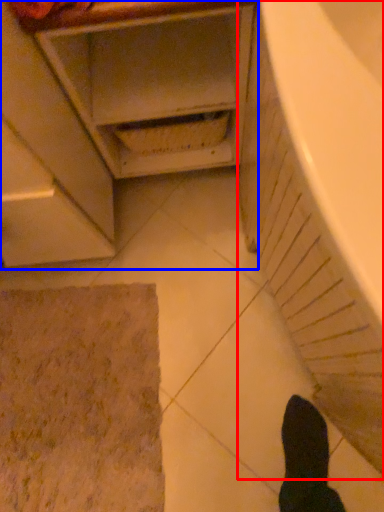
Question: Among these objects, which one is nearest to the camera, bath (highlighted by a red box) or cabinetry (highlighted by a blue box)?

Choices:
 (A) bath
 (B) cabinetry

Answer: (A)